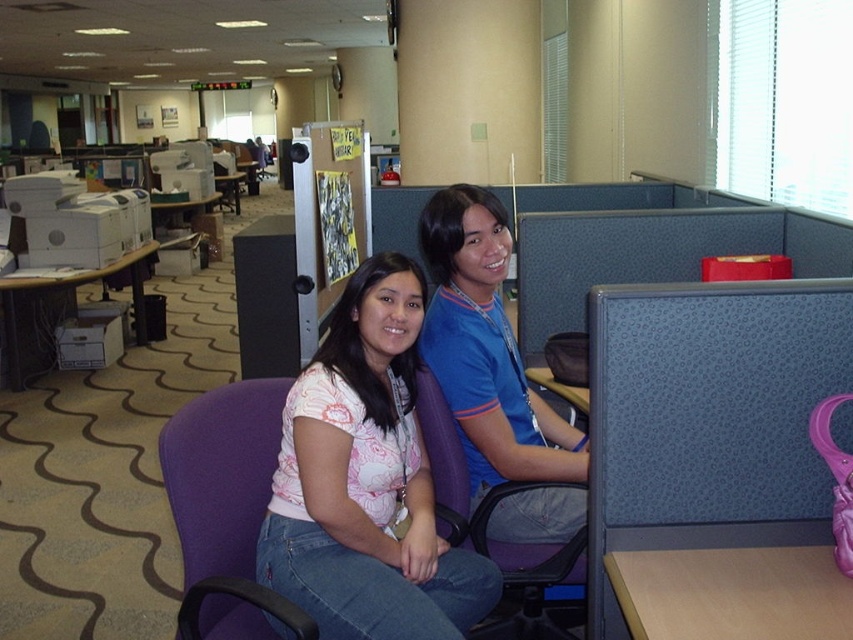
In the office scene, there are two people wearing a pink printed blouse at center and a matte blue shirt at center. From the perspective of someone standing in front of the cubicle, which clothing item is positioned to the left?

The pink printed blouse at center is to the left of the matte blue shirt at center.

You are standing at the camera position and want to place a small plant exactly 2 meters away from where you are standing. Is there enough space between the point at coordinates point (x=463, y=337) and the camera to place the plant?

The distance between point (x=463, y=337) and the camera is 1.85 meters, which is less than the required 2 meters. Therefore, there is not enough space to place the plant at that location.

From the picture: You are trying to determine if the matte blue shirt at center and the purple fabric swivel chair at lower left can fit side by side on a shelf that is 1.2 meters wide. Based on their widths, can they both fit?

The matte blue shirt at center might be wider than purple fabric swivel chair at lower left, so it is uncertain if they can both fit on the 1.2 meters wide shelf without overlapping.